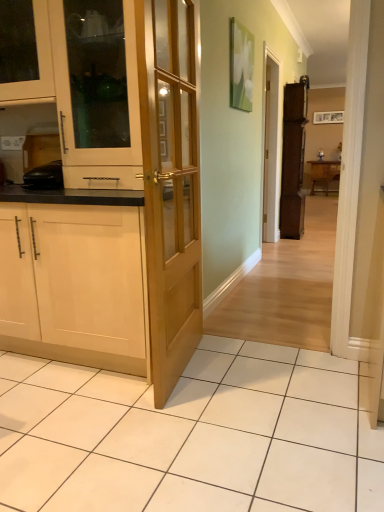
This screenshot has width=384, height=512. Describe the element at coordinates (170, 185) in the screenshot. I see `light wood door at center` at that location.

This screenshot has width=384, height=512. In order to click on light wood door at center in this screenshot , I will do `click(170, 185)`.

Find the location of a particular element. The image size is (384, 512). white wood cabinet at left, the 2th cabinetry in the front-to-back sequence is located at coordinates (80, 88).

The width and height of the screenshot is (384, 512). I want to click on brown wooden cabinet at right, marked as the first cabinetry in a back-to-front arrangement, so click(x=293, y=159).

This screenshot has height=512, width=384. What do you see at coordinates (293, 159) in the screenshot?
I see `brown wooden cabinet at right, which ranks as the 4th cabinetry in front-to-back order` at bounding box center [293, 159].

Describe the element at coordinates (38, 62) in the screenshot. I see `matte wood cabinet at upper left, the 2th cabinetry from the back` at that location.

At what (x,y) coordinates should I click in order to perform the action: click on light wood cabinet at left, which appears as the second cabinetry when viewed from the left. Please return your answer as a coordinate pair (x, y). Looking at the image, I should click on (73, 285).

Is there a large distance between light wood cabinet at left, the fourth cabinetry from the back, and matte wood cabinet at upper left, which is the fourth cabinetry in right-to-left order?

No, there isn't a large distance between light wood cabinet at left, the fourth cabinetry from the back, and matte wood cabinet at upper left, which is the fourth cabinetry in right-to-left order.

Would you say light wood cabinet at left, acting as the 1th cabinetry starting from the front, is to the left or to the right of matte wood cabinet at upper left, marked as the 1th cabinetry in a left-to-right arrangement, in the picture?

light wood cabinet at left, acting as the 1th cabinetry starting from the front, is to the right of matte wood cabinet at upper left, marked as the 1th cabinetry in a left-to-right arrangement.

From a real-world perspective, is light wood cabinet at left, positioned as the third cabinetry in right-to-left order, under matte wood cabinet at upper left, which ranks as the third cabinetry in front-to-back order?

Yes, from a real-world perspective, light wood cabinet at left, positioned as the third cabinetry in right-to-left order, is under matte wood cabinet at upper left, which ranks as the third cabinetry in front-to-back order.

From the image's perspective, does light wood cabinet at left, positioned as the third cabinetry in right-to-left order, appear higher than matte wood cabinet at upper left, which ranks as the third cabinetry in front-to-back order?

No.

From the image's perspective, which one is positioned higher, wooden table at right or light wood door at center?

wooden table at right, from the image's perspective.

How distant is wooden table at right from light wood door at center?

wooden table at right is 7.05 meters from light wood door at center.

Between wooden table at right and light wood door at center, which one has less height?

With less height is wooden table at right.

Is wooden table at right facing towards light wood door at center?

Yes.

Locate an element on the screen. Image resolution: width=384 pixels, height=512 pixels. door positioned vertically above the wooden table at right (from a real-world perspective) is located at coordinates (170, 185).

Is light wood door at center not close to wooden table at right?

Absolutely, light wood door at center is distant from wooden table at right.

Is wooden table at right at the back of light wood door at center?

That's not correct — light wood door at center is not looking away from wooden table at right.

Consider the image. Can you confirm if light wood door at center is positioned to the right of wooden table at right?

Incorrect, light wood door at center is not on the right side of wooden table at right.

Could you tell me if wooden table at right is facing brown wooden cabinet at right, which ranks as the 4th cabinetry in front-to-back order?

Yes, wooden table at right faces towards brown wooden cabinet at right, which ranks as the 4th cabinetry in front-to-back order.

From a real-world perspective, is wooden table at right positioned over brown wooden cabinet at right, which ranks as the 4th cabinetry in front-to-back order, based on gravity?

No, from a real-world perspective, wooden table at right is not over brown wooden cabinet at right, which ranks as the 4th cabinetry in front-to-back order

Is wooden table at right directly adjacent to brown wooden cabinet at right, which ranks as the 4th cabinetry in front-to-back order?

No, wooden table at right is not in contact with brown wooden cabinet at right, which ranks as the 4th cabinetry in front-to-back order.

Can you tell me how much wooden table at right and brown wooden cabinet at right, marked as the first cabinetry in a back-to-front arrangement, differ in facing direction?

The facing directions of wooden table at right and brown wooden cabinet at right, marked as the first cabinetry in a back-to-front arrangement, are 93.9 degrees apart.

From the image's perspective, between brown wooden cabinet at right, which ranks as the 4th cabinetry in front-to-back order, and white wood cabinet at left, placed as the third cabinetry when sorted from left to right, which one is located above?

brown wooden cabinet at right, which ranks as the 4th cabinetry in front-to-back order, is shown above in the image.

In the scene shown: Is brown wooden cabinet at right, marked as the first cabinetry in a back-to-front arrangement, shorter than white wood cabinet at left, the 2th cabinetry in the front-to-back sequence?

In fact, brown wooden cabinet at right, marked as the first cabinetry in a back-to-front arrangement, may be taller than white wood cabinet at left, the 2th cabinetry in the front-to-back sequence.

Which is farther, (299, 234) or (97, 168)?

The point (299, 234) is behind.

Is brown wooden cabinet at right, which ranks as the 4th cabinetry in front-to-back order, beside white wood cabinet at left, positioned as the 2th cabinetry in right-to-left order?

No, brown wooden cabinet at right, which ranks as the 4th cabinetry in front-to-back order, is not beside white wood cabinet at left, positioned as the 2th cabinetry in right-to-left order.

Is point (127, 216) closer or farther from the camera than point (338, 166)?

Point (127, 216) is positioned closer to the camera compared to point (338, 166).

Based on the photo, from the image's perspective, between light wood cabinet at left, which appears as the second cabinetry when viewed from the left, and wooden table at right, who is located below?

light wood cabinet at left, which appears as the second cabinetry when viewed from the left.

What's the angular difference between light wood cabinet at left, positioned as the third cabinetry in right-to-left order, and wooden table at right's facing directions?

2.5 degrees separate the facing orientations of light wood cabinet at left, positioned as the third cabinetry in right-to-left order, and wooden table at right.

Which point is more forward, (42, 24) or (185, 349)?

The point (42, 24) is closer to the camera.

Based on their positions, is matte wood cabinet at upper left, marked as the 1th cabinetry in a left-to-right arrangement, located to the left or right of light wood door at center?

From the image, it's evident that matte wood cabinet at upper left, marked as the 1th cabinetry in a left-to-right arrangement, is to the left of light wood door at center.

What's the angular difference between matte wood cabinet at upper left, marked as the 1th cabinetry in a left-to-right arrangement, and light wood door at center's facing directions?

They differ by 95.6 degrees in their facing directions.

Based on the photo, who is taller, matte wood cabinet at upper left, marked as the 1th cabinetry in a left-to-right arrangement, or light wood door at center?

With more height is light wood door at center.

Which cabinetry is the 2nd one when counting from the front of the matte wood cabinet at upper left, which is the fourth cabinetry in right-to-left order? Please provide its 2D coordinates.

[(73, 285)]

This screenshot has height=512, width=384. I want to click on table behind the light wood door at center, so click(324, 172).

From the picture: Estimate the real-world distances between objects in this image. Which object is further from white wood cabinet at left, placed as the third cabinetry when sorted from left to right, wooden table at right or light wood cabinet at left, acting as the 1th cabinetry starting from the front?

Among the two, wooden table at right is located further to white wood cabinet at left, placed as the third cabinetry when sorted from left to right.

Based on their spatial positions, is wooden table at right or light wood cabinet at left, the fourth cabinetry from the back, further from brown wooden cabinet at right, which is the first cabinetry in right-to-left order?

The object further to brown wooden cabinet at right, which is the first cabinetry in right-to-left order, is light wood cabinet at left, the fourth cabinetry from the back.

Estimate the real-world distances between objects in this image. Which object is further from brown wooden cabinet at right, the fourth cabinetry from the left, light wood cabinet at left, the fourth cabinetry from the back, or light wood door at center?

Among the two, light wood cabinet at left, the fourth cabinetry from the back, is located further to brown wooden cabinet at right, the fourth cabinetry from the left.

From the image, which object appears to be farther from light wood door at center, white wood cabinet at left, the 3th cabinetry when ordered from back to front, or matte wood cabinet at upper left, which ranks as the third cabinetry in front-to-back order?

matte wood cabinet at upper left, which ranks as the third cabinetry in front-to-back order, is further to light wood door at center.

Estimate the real-world distances between objects in this image. Which object is further from brown wooden cabinet at right, which is the first cabinetry in right-to-left order, light wood cabinet at left, acting as the 1th cabinetry starting from the front, or white wood cabinet at left, positioned as the 2th cabinetry in right-to-left order?

light wood cabinet at left, acting as the 1th cabinetry starting from the front, lies further to brown wooden cabinet at right, which is the first cabinetry in right-to-left order, than the other object.

Estimate the real-world distances between objects in this image. Which object is further from white wood cabinet at left, the 3th cabinetry when ordered from back to front, light wood door at center or light wood cabinet at left, positioned as the third cabinetry in right-to-left order?

The object further to white wood cabinet at left, the 3th cabinetry when ordered from back to front, is light wood cabinet at left, positioned as the third cabinetry in right-to-left order.

From the picture: From the image, which object appears to be nearer to matte wood cabinet at upper left, marked as the 1th cabinetry in a left-to-right arrangement, wooden table at right or light wood cabinet at left, acting as the 1th cabinetry starting from the front?

light wood cabinet at left, acting as the 1th cabinetry starting from the front, is positioned closer to the anchor matte wood cabinet at upper left, marked as the 1th cabinetry in a left-to-right arrangement.

Consider the image. Based on their spatial positions, is light wood door at center or matte wood cabinet at upper left, which is the fourth cabinetry in right-to-left order, closer to light wood cabinet at left, which appears as the second cabinetry when viewed from the left?

light wood door at center lies closer to light wood cabinet at left, which appears as the second cabinetry when viewed from the left, than the other object.

At what (x,y) coordinates should I click in order to perform the action: click on door between matte wood cabinet at upper left, the 2th cabinetry from the back, and light wood cabinet at left, acting as the 1th cabinetry starting from the front, vertically. Please return your answer as a coordinate pair (x, y). Looking at the image, I should click on (170, 185).

The image size is (384, 512). In order to click on door that lies between white wood cabinet at left, the 2th cabinetry in the front-to-back sequence, and light wood cabinet at left, the fourth cabinetry from the back, from top to bottom in this screenshot , I will do `click(170, 185)`.

The height and width of the screenshot is (512, 384). What are the coordinates of `cabinetry between matte wood cabinet at upper left, which ranks as the third cabinetry in front-to-back order, and light wood cabinet at left, the fourth cabinetry from the back, vertically` in the screenshot? It's located at (80, 88).

You are a GUI agent. You are given a task and a screenshot of the screen. Output one action in this format:
    pyautogui.click(x=<x>, y=<y>)
    Task: Click on the cabinetry between white wood cabinet at left, positioned as the 2th cabinetry in right-to-left order, and brown wooden cabinet at right, which is the first cabinetry in right-to-left order, in the front-back direction
    The width and height of the screenshot is (384, 512).
    Given the screenshot: What is the action you would take?
    pyautogui.click(x=38, y=62)